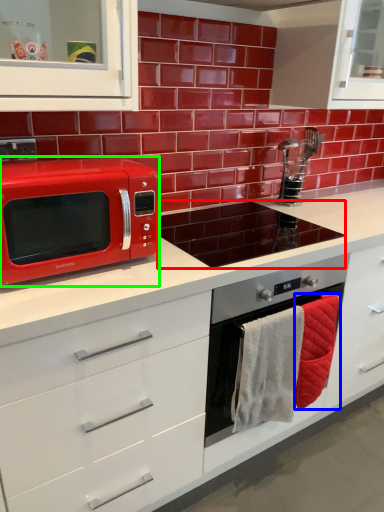
Question: Considering the real-world distances, which object is closest to appliance (highlighted by a red box)? hand towel (highlighted by a blue box) or microwave oven (highlighted by a green box).

Choices:
 (A) hand towel
 (B) microwave oven

Answer: (A)